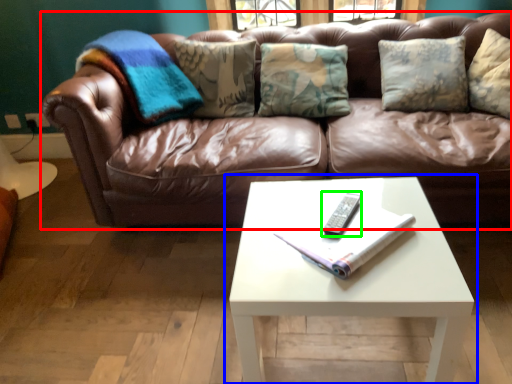
Question: Which object is positioned closest to studio couch (highlighted by a red box)? Select from coffee table (highlighted by a blue box) and remote (highlighted by a green box).

Choices:
 (A) coffee table
 (B) remote

Answer: (A)